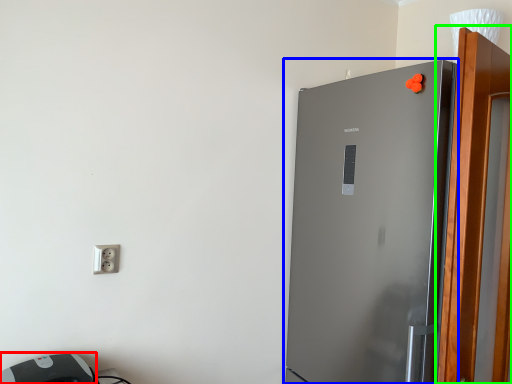
Question: Considering the real-world distances, which object is farthest from appliance (highlighted by a red box)? refrigerator (highlighted by a blue box) or screen door (highlighted by a green box)?

Choices:
 (A) refrigerator
 (B) screen door

Answer: (B)